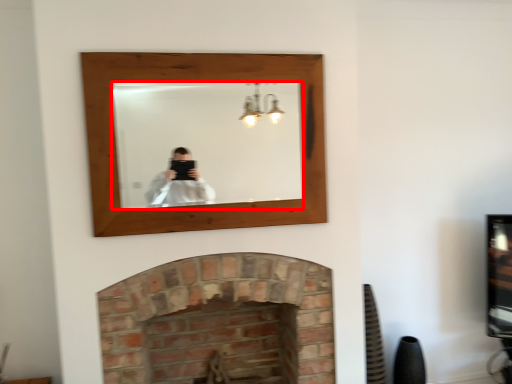
Question: Considering the relative positions of mirror (annotated by the red box) and fireplace in the image provided, where is mirror (annotated by the red box) located with respect to the staircase?

Choices:
 (A) left
 (B) right

Answer: (A)